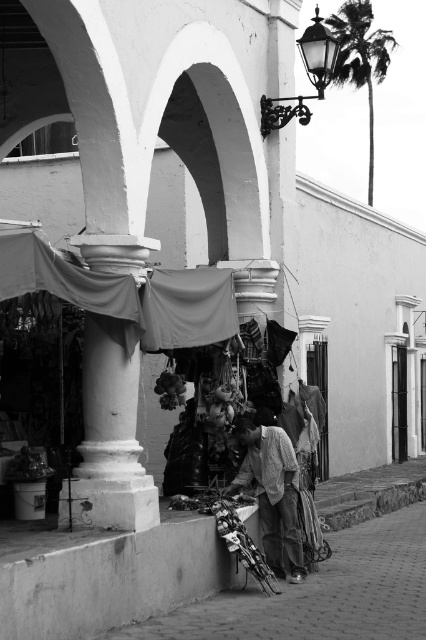
Question: Is smooth concrete pavement at lower center wider than light gray fabric at center?

Choices:
 (A) yes
 (B) no

Answer: (A)

Question: Is smooth concrete pavement at lower center positioned in front of light gray fabric at center?

Choices:
 (A) yes
 (B) no

Answer: (A)

Question: Considering the relative positions of smooth concrete pavement at lower center and light gray fabric at center in the image provided, where is smooth concrete pavement at lower center located with respect to light gray fabric at center?

Choices:
 (A) below
 (B) above

Answer: (A)

Question: Which object is farther from the camera taking this photo?

Choices:
 (A) smooth concrete pavement at lower center
 (B) light gray fabric at center

Answer: (B)